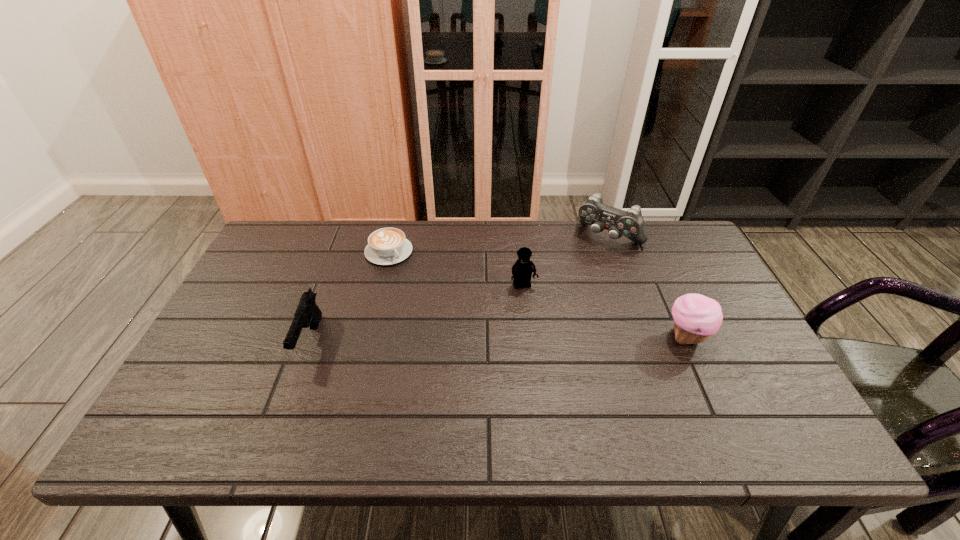
Identify the location of pistol. The height and width of the screenshot is (540, 960). (307, 314).

The height and width of the screenshot is (540, 960). In order to click on the second shortest object in this screenshot , I will do `click(307, 314)`.

Find the location of `cupcake`. cupcake is located at coordinates click(696, 317).

At what (x,y) coordinates should I click in order to perform the action: click on the shortest object. Please return your answer as a coordinate pair (x, y). The width and height of the screenshot is (960, 540). Looking at the image, I should click on (386, 246).

Locate an element on the screen. This screenshot has width=960, height=540. cappuccino is located at coordinates (386, 246).

The height and width of the screenshot is (540, 960). I want to click on the third object from left to right, so click(x=522, y=270).

The width and height of the screenshot is (960, 540). In order to click on Lego in this screenshot , I will do `click(522, 270)`.

Where is `control`? This screenshot has height=540, width=960. control is located at coordinates (630, 224).

At what (x,y) coordinates should I click in order to perform the action: click on vacant space situated on the front of the cupcake. Please return your answer as a coordinate pair (x, y). Looking at the image, I should click on (713, 397).

Where is `free location located on the side of the shortest object with the handle`? The width and height of the screenshot is (960, 540). free location located on the side of the shortest object with the handle is located at coordinates (468, 350).